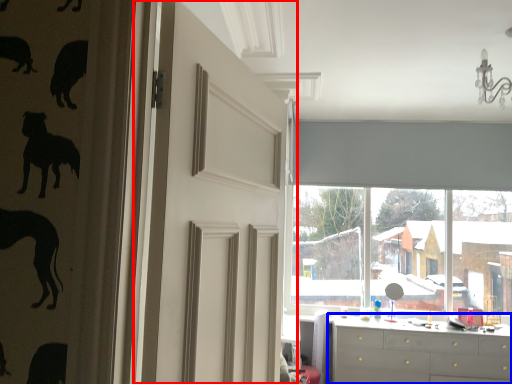
Question: Which point is further to the camera, door (highlighted by a red box) or chest of drawers (highlighted by a blue box)?

Choices:
 (A) door
 (B) chest of drawers

Answer: (B)